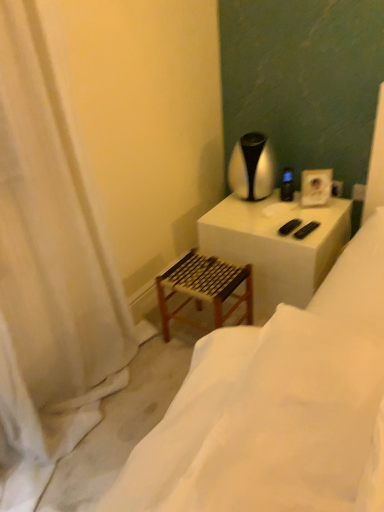
This screenshot has height=512, width=384. I want to click on wooden woven step stool at lower left, so click(204, 289).

Find the location of a particular element. This screenshot has width=384, height=512. white fabric curtain at left is located at coordinates (49, 266).

Locate an element on the screen. Image resolution: width=384 pixels, height=512 pixels. black plastic remote control at upper right is located at coordinates (287, 185).

Between white matte table at upper right and black plastic remote control at upper right, which one has larger size?

white matte table at upper right.

In the scene shown: Is white matte table at upper right turned away from black plastic remote control at upper right?

No, black plastic remote control at upper right is not at the back of white matte table at upper right.

How many degrees apart are the facing directions of white matte table at upper right and black plastic remote control at upper right?

The angle between the facing direction of white matte table at upper right and the facing direction of black plastic remote control at upper right is 24.3 degrees.

Considering the sizes of white matte table at upper right and black plastic remote control at upper right in the image, is white matte table at upper right wider or thinner than black plastic remote control at upper right?

Considering their sizes, white matte table at upper right looks broader than black plastic remote control at upper right.

In the scene shown: From a real-world perspective, is wooden woven step stool at lower left positioned above or below white matte table at upper right?

From a real-world perspective, wooden woven step stool at lower left is physically below white matte table at upper right.

Between wooden woven step stool at lower left and white matte table at upper right, which one appears on the right side from the viewer's perspective?

Positioned to the right is white matte table at upper right.

Is wooden woven step stool at lower left facing away from white matte table at upper right?

That's right, wooden woven step stool at lower left is facing away from white matte table at upper right.

Locate an element on the screen. The width and height of the screenshot is (384, 512). step stool that appears on the left of white matte table at upper right is located at coordinates (204, 289).

From a real-world perspective, is black plastic remote control at upper right beneath wooden stool at lower left?

Indeed, from a real-world perspective, black plastic remote control at upper right is positioned beneath wooden stool at lower left.

Locate an element on the screen. This screenshot has height=512, width=384. furniture on the left side of black plastic remote control at upper right is located at coordinates (277, 407).

From the image's perspective, is black plastic remote control at upper right above wooden stool at lower left?

Yes, from the image's perspective, black plastic remote control at upper right is over wooden stool at lower left.

Which is in front, point (290, 172) or point (129, 468)?

The point (129, 468) is more forward.

I want to click on table lamp on the right of white fabric curtain at left, so click(x=252, y=167).

How far apart are silver metallic table lamp at upper right and white fabric curtain at left?

silver metallic table lamp at upper right and white fabric curtain at left are 3.35 feet apart from each other.

Which is in front, point (262, 170) or point (13, 136)?

Positioned in front is point (13, 136).

Can you confirm if wooden woven step stool at lower left is wider than white fabric curtain at left?

In fact, wooden woven step stool at lower left might be narrower than white fabric curtain at left.

Based on the photo, from the image's perspective, relative to white fabric curtain at left, is wooden woven step stool at lower left above or below?

Based on their image positions, wooden woven step stool at lower left is located beneath white fabric curtain at left.

From a real-world perspective, which object rests below the other?

wooden woven step stool at lower left, from a real-world perspective.

How different are the orientations of wooden woven step stool at lower left and white fabric curtain at left in degrees?

They differ by 91.2 degrees in their facing directions.

From the image's perspective, who appears lower, silver metallic table lamp at upper right or wooden woven step stool at lower left?

wooden woven step stool at lower left is shown below in the image.

I want to click on step stool below the silver metallic table lamp at upper right (from a real-world perspective), so click(x=204, y=289).

Which of these two, silver metallic table lamp at upper right or wooden woven step stool at lower left, stands shorter?

silver metallic table lamp at upper right is shorter.

From the image's perspective, is wooden stool at lower left located beneath white fabric curtain at left?

Yes.

From a real-world perspective, does wooden stool at lower left stand above white fabric curtain at left?

Actually, wooden stool at lower left is physically below white fabric curtain at left in the real world.

Can you confirm if wooden stool at lower left is smaller than white fabric curtain at left?

Correct, wooden stool at lower left occupies less space than white fabric curtain at left.

From the picture: Relative to white fabric curtain at left, is wooden stool at lower left in front or behind?

Visually, wooden stool at lower left is located in front of white fabric curtain at left.

Locate an element on the screen. The height and width of the screenshot is (512, 384). table located below the black plastic remote control at upper right (from the image's perspective) is located at coordinates (276, 246).

Find the location of a particular element. step stool located in front of the white matte table at upper right is located at coordinates (204, 289).

Which object lies further to the anchor point silver metallic table lamp at upper right, white matte table at upper right or wooden woven step stool at lower left?

Based on the image, wooden woven step stool at lower left appears to be further to silver metallic table lamp at upper right.

Estimate the real-world distances between objects in this image. Which object is closer to silver metallic table lamp at upper right, wooden woven step stool at lower left or black plastic remote control at upper right?

The object closer to silver metallic table lamp at upper right is black plastic remote control at upper right.

When comparing their distances from wooden woven step stool at lower left, does white matte table at upper right or white fabric curtain at left seem further?

white fabric curtain at left is further to wooden woven step stool at lower left.

From the image, which object appears to be farther from black plastic remote control at upper right, white matte table at upper right or white fabric curtain at left?

Based on the image, white fabric curtain at left appears to be further to black plastic remote control at upper right.

Considering their positions, is black plastic remote control at upper right positioned closer to white fabric curtain at left than silver metallic table lamp at upper right?

The object closer to white fabric curtain at left is silver metallic table lamp at upper right.

Which object lies nearer to the anchor point white fabric curtain at left, white matte table at upper right or wooden stool at lower left?

wooden stool at lower left is positioned closer to the anchor white fabric curtain at left.

Estimate the real-world distances between objects in this image. Which object is closer to white matte table at upper right, silver metallic table lamp at upper right or white fabric curtain at left?

The object closer to white matte table at upper right is silver metallic table lamp at upper right.

Looking at the image, which one is located further to wooden woven step stool at lower left, wooden stool at lower left or black plastic remote control at upper right?

Based on the image, wooden stool at lower left appears to be further to wooden woven step stool at lower left.

Image resolution: width=384 pixels, height=512 pixels. What are the coordinates of `step stool between wooden stool at lower left and silver metallic table lamp at upper right in the front-back direction` in the screenshot? It's located at (204, 289).

At what (x,y) coordinates should I click in order to perform the action: click on curtain between wooden stool at lower left and wooden woven step stool at lower left in the front-back direction. Please return your answer as a coordinate pair (x, y). This screenshot has height=512, width=384. Looking at the image, I should click on (49, 266).

Locate an element on the screen. The height and width of the screenshot is (512, 384). table between wooden stool at lower left and black plastic remote control at upper right from front to back is located at coordinates (276, 246).

You are a GUI agent. You are given a task and a screenshot of the screen. Output one action in this format:
    pyautogui.click(x=<x>, y=<y>)
    Task: Click on the step stool positioned between white fabric curtain at left and black plastic remote control at upper right from near to far
    The height and width of the screenshot is (512, 384).
    Given the screenshot: What is the action you would take?
    coord(204,289)